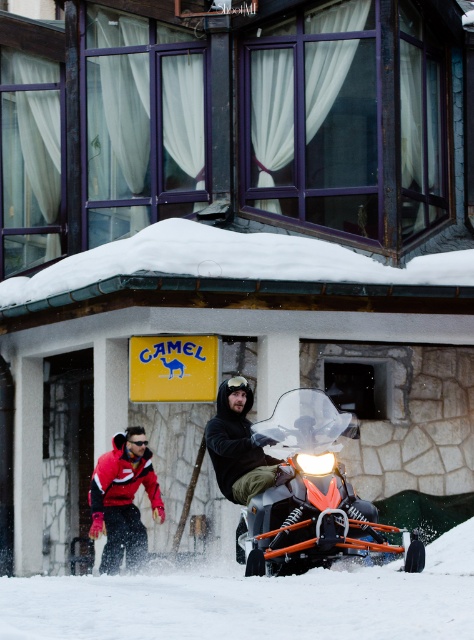
What are the coordinates of the orange metallic snowmobile at center?

The orange metallic snowmobile at center is located at coordinates point [310,497].

You are standing at the point marked by the coordinates point (310, 497). What object is directly in front of you?

The orange metallic snowmobile at center is directly in front of you at point (310, 497).